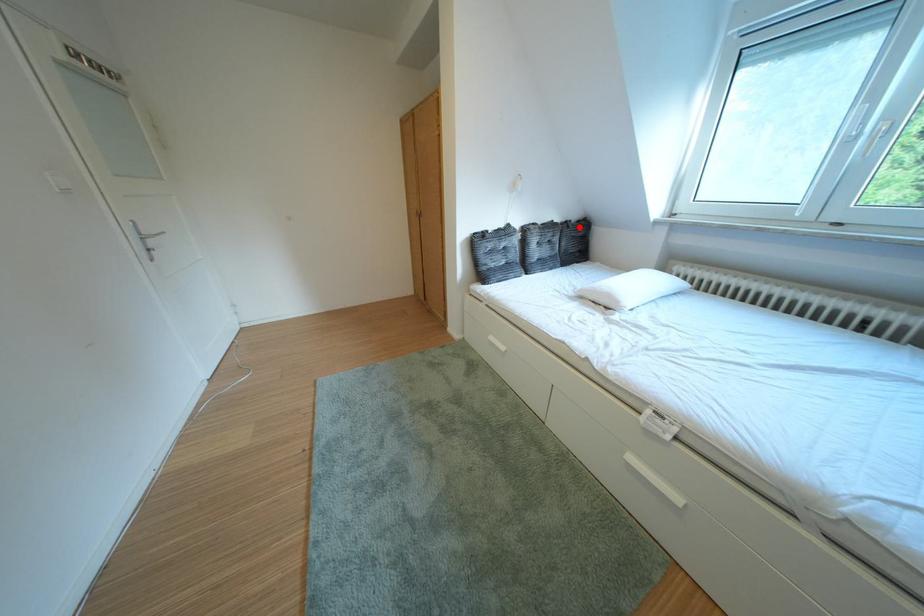
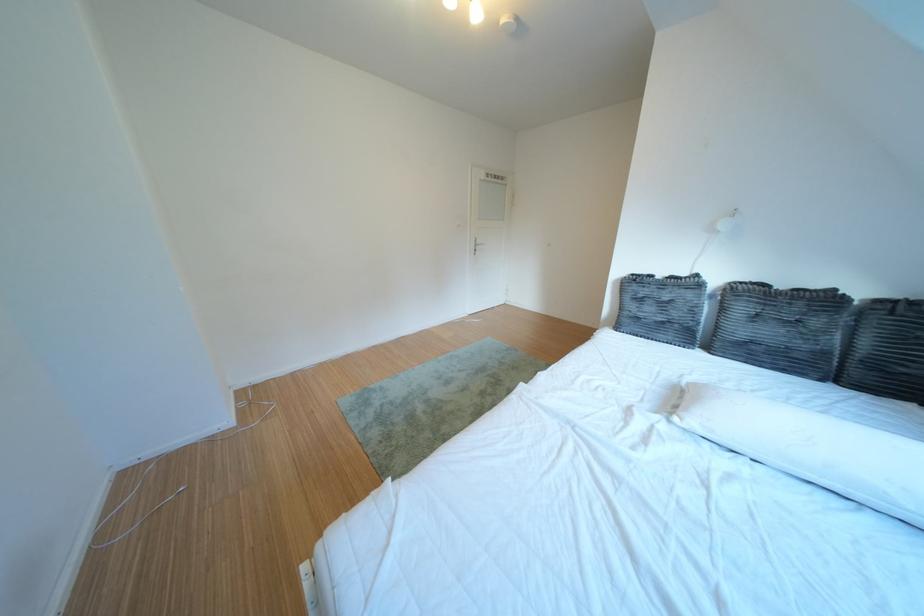
In the second image, find the point that corresponds to the highlighted location in the first image.

(910, 306)